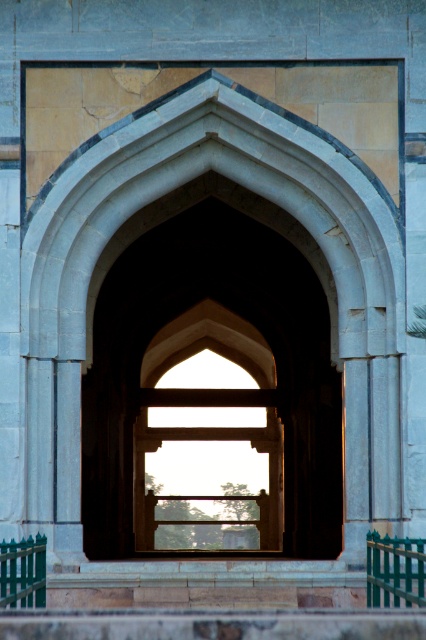
Which is below, smooth stone arch at center or green painted metal railing at lower right?

green painted metal railing at lower right is below.

Between point (236, 298) and point (419, 576), which one is positioned in front?

Positioned in front is point (419, 576).

You are a GUI agent. You are given a task and a screenshot of the screen. Output one action in this format:
    pyautogui.click(x=<x>, y=<y>)
    Task: Click on the smooth stone arch at center
    
    Given the screenshot: What is the action you would take?
    (241, 316)

Who is taller, green painted metal railing at lower right or green painted wood at lower left?

green painted metal railing at lower right is taller.

Who is positioned more to the left, green painted metal railing at lower right or green painted wood at lower left?

From the viewer's perspective, green painted wood at lower left appears more on the left side.

Is point (377, 602) farther from viewer compared to point (19, 582)?

That is True.

The width and height of the screenshot is (426, 640). In order to click on green painted metal railing at lower right in this screenshot , I will do `click(394, 570)`.

Is smooth stone arch at center taller than green painted wood at lower left?

Correct, smooth stone arch at center is much taller as green painted wood at lower left.

Is point (299, 355) closer to viewer compared to point (0, 556)?

No, (299, 355) is behind (0, 556).

You are a GUI agent. You are given a task and a screenshot of the screen. Output one action in this format:
    pyautogui.click(x=<x>, y=<y>)
    Task: Click on the smooth stone arch at center
    This screenshot has width=426, height=640.
    Given the screenshot: What is the action you would take?
    pyautogui.click(x=241, y=316)